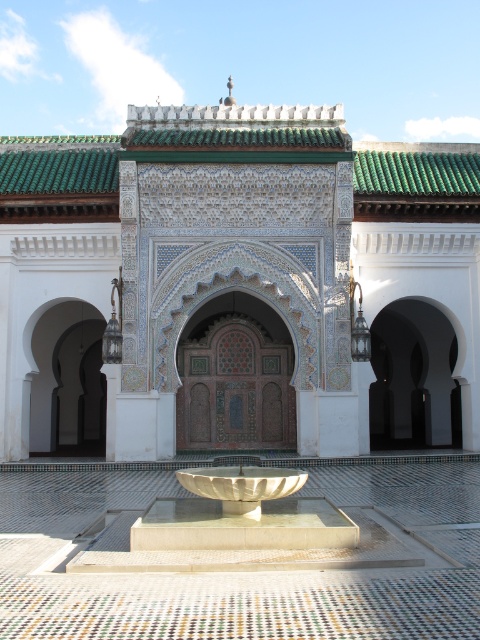
Question: Does white marble fountain at center have a greater width compared to white stone bowl at center?

Choices:
 (A) no
 (B) yes

Answer: (B)

Question: Estimate the real-world distances between objects in this image. Which object is farther from the white mosaic tile palace at center?

Choices:
 (A) white stone bowl at center
 (B) white marble fountain at center

Answer: (A)

Question: Which of these objects is positioned farthest from the white stone bowl at center?

Choices:
 (A) white mosaic tile palace at center
 (B) white marble fountain at center

Answer: (A)

Question: Does white mosaic tile palace at center have a lesser width compared to white stone bowl at center?

Choices:
 (A) no
 (B) yes

Answer: (A)

Question: Is white marble fountain at center further to camera compared to white stone bowl at center?

Choices:
 (A) yes
 (B) no

Answer: (B)

Question: Which point is farther to the camera?

Choices:
 (A) (233, 480)
 (B) (242, 493)
 (C) (35, 356)

Answer: (C)